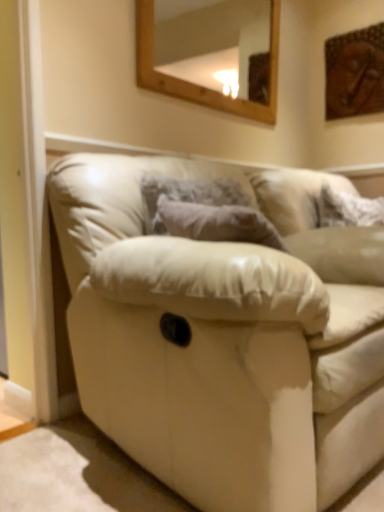
Question: Could you tell me if white fluffy pillow at upper right is turned towards leather couch at center?

Choices:
 (A) yes
 (B) no

Answer: (B)

Question: Can you see white fluffy pillow at upper right touching leather couch at center?

Choices:
 (A) no
 (B) yes

Answer: (A)

Question: Does white fluffy pillow at upper right have a lesser height compared to leather couch at center?

Choices:
 (A) no
 (B) yes

Answer: (B)

Question: Does white fluffy pillow at upper right have a smaller size compared to leather couch at center?

Choices:
 (A) no
 (B) yes

Answer: (B)

Question: Is white fluffy pillow at upper right bigger than leather couch at center?

Choices:
 (A) yes
 (B) no

Answer: (B)

Question: In terms of size, does leather couch at center appear bigger or smaller than wooden-framed mirror at upper center?

Choices:
 (A) small
 (B) big

Answer: (B)

Question: Visually, is leather couch at center positioned to the left or to the right of wooden-framed mirror at upper center?

Choices:
 (A) right
 (B) left

Answer: (A)

Question: From a real-world perspective, is leather couch at center above or below wooden-framed mirror at upper center?

Choices:
 (A) above
 (B) below

Answer: (B)

Question: Considering the positions of point (261, 203) and point (216, 30), is point (261, 203) closer or farther from the camera than point (216, 30)?

Choices:
 (A) closer
 (B) farther

Answer: (A)

Question: Does point (206, 23) appear closer or farther from the camera than point (377, 73)?

Choices:
 (A) farther
 (B) closer

Answer: (A)

Question: Is wooden-framed mirror at upper center taller or shorter than wooden carving at upper right?

Choices:
 (A) tall
 (B) short

Answer: (A)

Question: From the image's perspective, is wooden-framed mirror at upper center positioned above or below wooden carving at upper right?

Choices:
 (A) above
 (B) below

Answer: (B)

Question: Visually, is wooden-framed mirror at upper center positioned to the left or to the right of wooden carving at upper right?

Choices:
 (A) right
 (B) left

Answer: (B)

Question: Looking at the image, does white fluffy pillow at upper right seem bigger or smaller compared to leather couch at center?

Choices:
 (A) small
 (B) big

Answer: (A)

Question: Considering the positions of white fluffy pillow at upper right and leather couch at center in the image, is white fluffy pillow at upper right taller or shorter than leather couch at center?

Choices:
 (A) tall
 (B) short

Answer: (B)